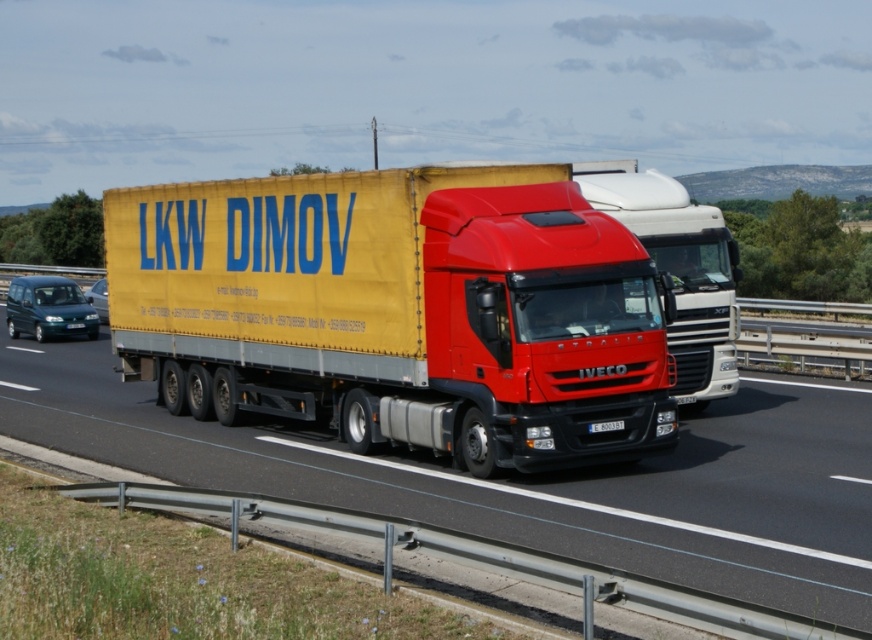
You are a driver approaching the highway and see the teal glossy van at left and the metallic blue van at left. Which van should you be cautious of overtaking first?

The teal glossy van at left is closer to the viewer than the metallic blue van at left, so you should be cautious of overtaking the teal glossy van at left first because it is nearer and poses an immediate obstacle.

You are a driver approaching the highway scene. You notice a point marked at coordinates (48,308). Which vehicle does this point indicate?

The point marked at coordinates (48,308) indicates the teal glossy van at left.

You are a driver on the highway and see the teal glossy van at left and the metallic blue van at left. Which van is positioned higher in the image?

The teal glossy van at left is positioned higher in the image than the metallic blue van at left.